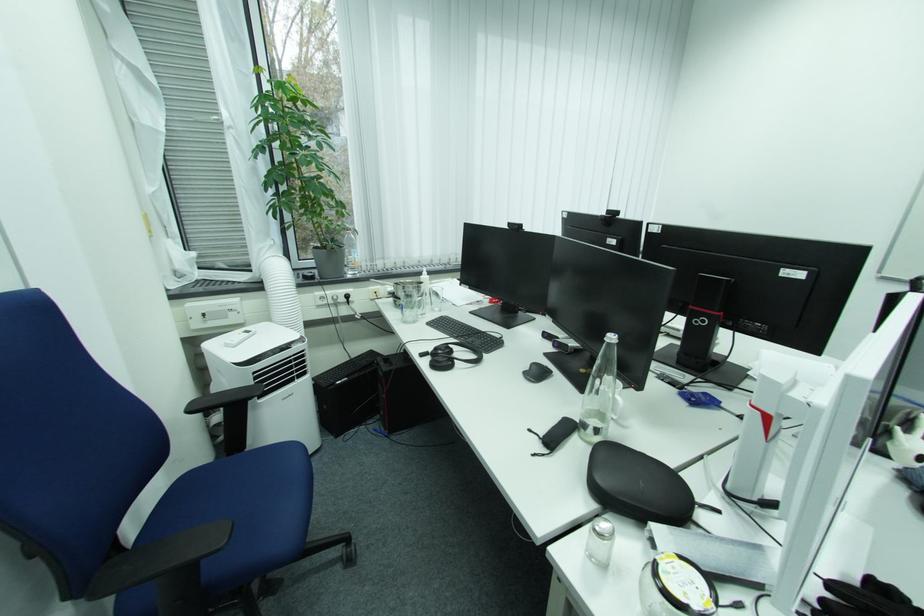
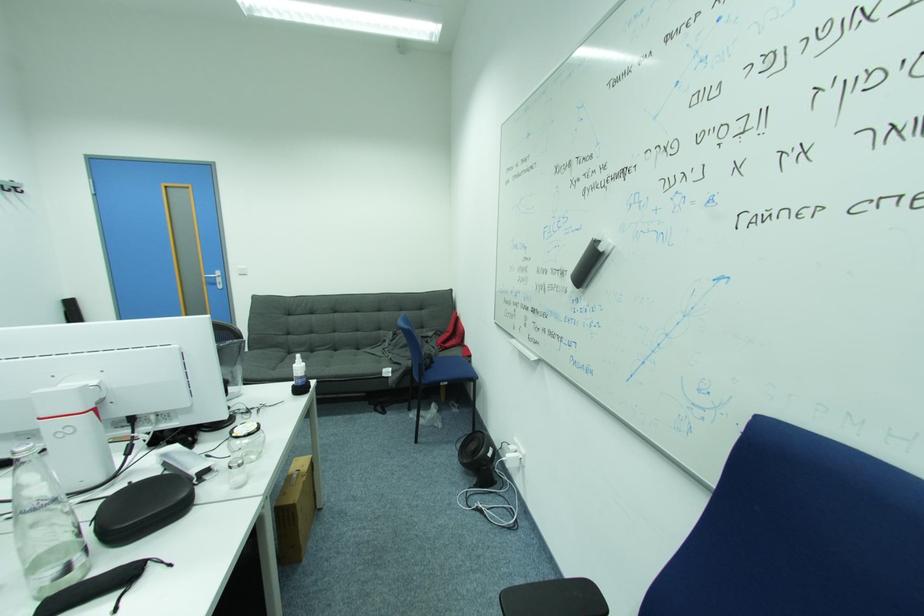
Find the pixel in the second image that matches the point at 726,513 in the first image.

(138, 484)